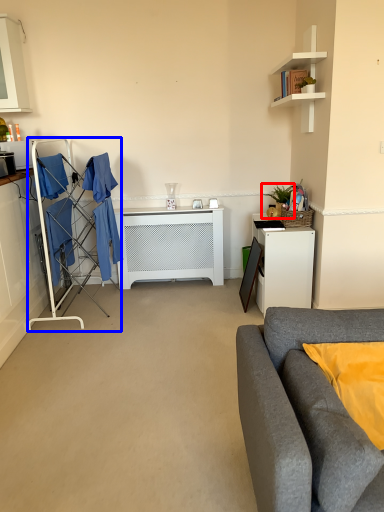
Question: Among these objects, which one is farthest to the camera, houseplant (highlighted by a red box) or closet (highlighted by a blue box)?

Choices:
 (A) houseplant
 (B) closet

Answer: (A)